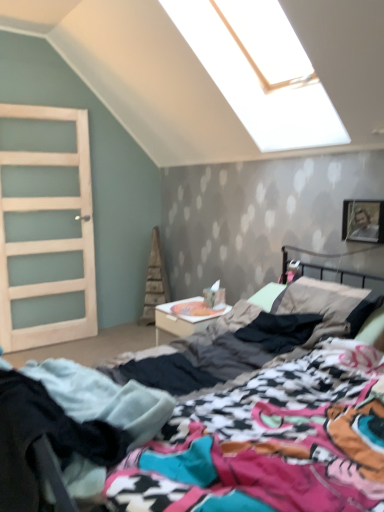
Question: From the image's perspective, is white glossy nightstand at center located beneath clear glass door at left?

Choices:
 (A) no
 (B) yes

Answer: (B)

Question: Can you confirm if white glossy nightstand at center is smaller than clear glass door at left?

Choices:
 (A) yes
 (B) no

Answer: (A)

Question: Is white glossy nightstand at center far away from clear glass door at left?

Choices:
 (A) yes
 (B) no

Answer: (A)

Question: Does white glossy nightstand at center lie behind clear glass door at left?

Choices:
 (A) yes
 (B) no

Answer: (B)

Question: Is white glossy nightstand at center wider than clear glass door at left?

Choices:
 (A) yes
 (B) no

Answer: (A)

Question: Is clear glass door at left wider or thinner than black cotton pants at lower left?

Choices:
 (A) wide
 (B) thin

Answer: (B)

Question: Based on their sizes in the image, would you say clear glass door at left is bigger or smaller than black cotton pants at lower left?

Choices:
 (A) small
 (B) big

Answer: (B)

Question: Considering the positions of clear glass door at left and black cotton pants at lower left in the image, is clear glass door at left taller or shorter than black cotton pants at lower left?

Choices:
 (A) tall
 (B) short

Answer: (A)

Question: From a real-world perspective, is clear glass door at left positioned above or below black cotton pants at lower left?

Choices:
 (A) above
 (B) below

Answer: (A)

Question: Is multicolored fabric bed at center taller or shorter than black cotton pants at lower left?

Choices:
 (A) short
 (B) tall

Answer: (B)

Question: From a real-world perspective, is multicolored fabric bed at center above or below black cotton pants at lower left?

Choices:
 (A) below
 (B) above

Answer: (A)

Question: Is multicolored fabric bed at center inside or outside of black cotton pants at lower left?

Choices:
 (A) inside
 (B) outside

Answer: (B)

Question: Is multicolored fabric bed at center wider or thinner than black cotton pants at lower left?

Choices:
 (A) wide
 (B) thin

Answer: (A)

Question: In terms of height, does black cotton pants at lower left look taller or shorter compared to white glossy nightstand at center?

Choices:
 (A) short
 (B) tall

Answer: (B)

Question: Is black cotton pants at lower left wider or thinner than white glossy nightstand at center?

Choices:
 (A) thin
 (B) wide

Answer: (A)